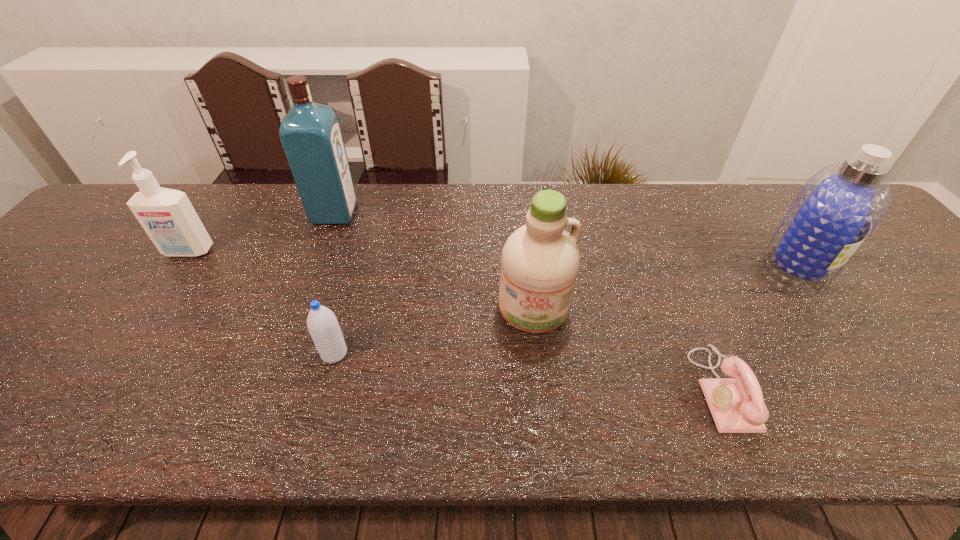
At what (x,y) coordinates should I click in order to perform the action: click on vacant area situated 0.360m on the left of the rightmost object. Please return your answer as a coordinate pair (x, y). This screenshot has width=960, height=540. Looking at the image, I should click on (613, 269).

Find the location of a particular element. free space located on the front label of the fourth object from left to right is located at coordinates (540, 374).

This screenshot has height=540, width=960. Identify the location of vacant space situated 0.370m on the front label of the leftmost object. click(x=96, y=388).

Where is `free space located 0.140m on the back of the third object from left to right`? free space located 0.140m on the back of the third object from left to right is located at coordinates (350, 295).

In order to click on free space located on the dial of the shortest object in this screenshot , I will do `click(595, 390)`.

Locate an element on the screen. vacant space situated on the dial of the shortest object is located at coordinates (550, 390).

Locate an element on the screen. free region located on the dial of the shortest object is located at coordinates (669, 390).

Identify the location of object located at the far edge. The height and width of the screenshot is (540, 960). (310, 133).

I want to click on object situated at the near edge, so click(x=737, y=405).

The image size is (960, 540). Find the location of `vacant area at the far edge`. vacant area at the far edge is located at coordinates (669, 234).